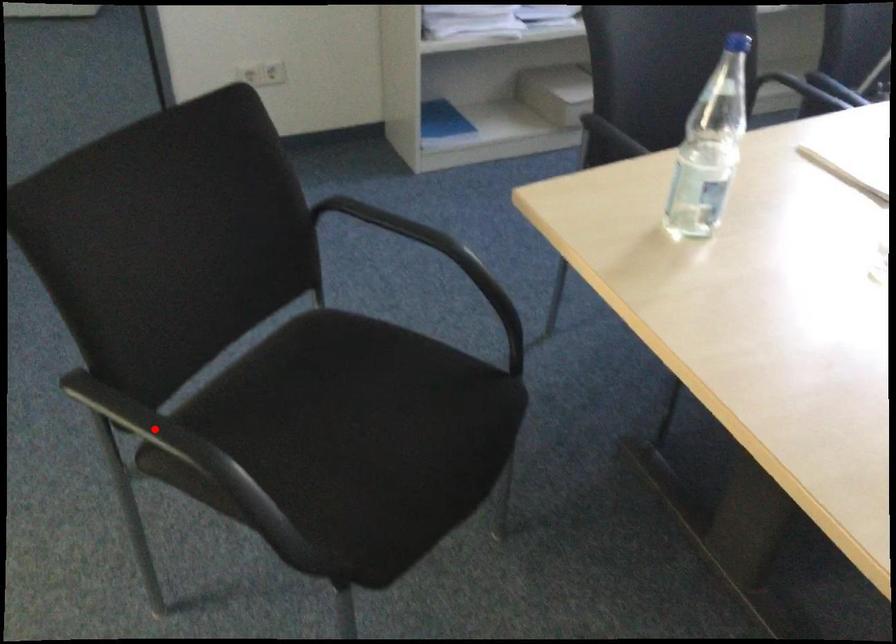
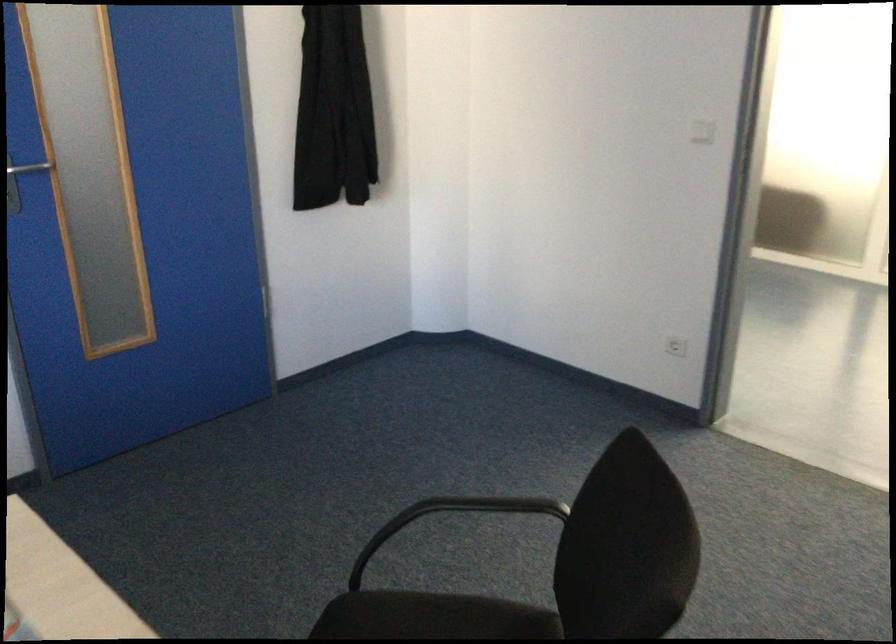
Question: I am providing you with two images of the same scene from different viewpoints. A red point is marked on the first image. Is the red point's position out of view in image 2?

Choices:
 (A) Yes
 (B) No

Answer: (A)